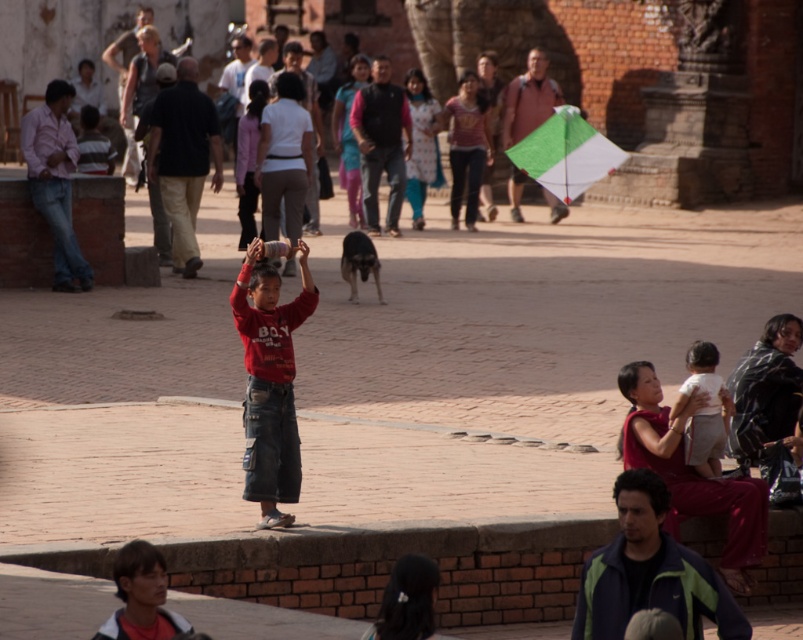
Can you confirm if green fabric kite at upper center is positioned below light brown fabric shirt at lower right?

Actually, green fabric kite at upper center is above light brown fabric shirt at lower right.

How far apart are green fabric kite at upper center and light brown fabric shirt at lower right?

They are 12.39 meters apart.

Does point (555, 131) come closer to viewer compared to point (714, 445)?

No.

At what (x,y) coordinates should I click in order to perform the action: click on green fabric kite at upper center. Please return your answer as a coordinate pair (x, y). The width and height of the screenshot is (803, 640). Looking at the image, I should click on (565, 154).

Who is positioned more to the right, matte black dog at center or green fabric kite at upper center?

green fabric kite at upper center

Looking at this image, which is more to the left, matte black dog at center or green fabric kite at upper center?

Positioned to the left is matte black dog at center.

Is point (441, 36) in front of point (561, 179)?

No, it is behind (561, 179).

Where is `matte black dog at center`? matte black dog at center is located at coordinates (431, 33).

Which is below, red cotton shirt at center or light brown fabric shirt at lower right?

Answer: light brown fabric shirt at lower right is below.

Between red cotton shirt at center and light brown fabric shirt at lower right, which one appears on the left side from the viewer's perspective?

From the viewer's perspective, red cotton shirt at center appears more on the left side.

This screenshot has width=803, height=640. Find the location of `red cotton shirt at center`. red cotton shirt at center is located at coordinates (268, 381).